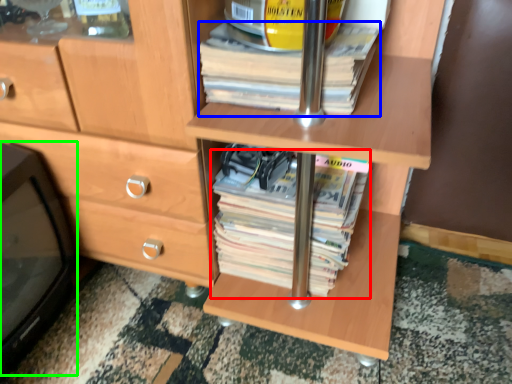
Question: Which object is positioned farthest from paperback book (highlighted by a red box)? Select from paperback book (highlighted by a blue box) and desktop (highlighted by a green box).

Choices:
 (A) paperback book
 (B) desktop

Answer: (B)